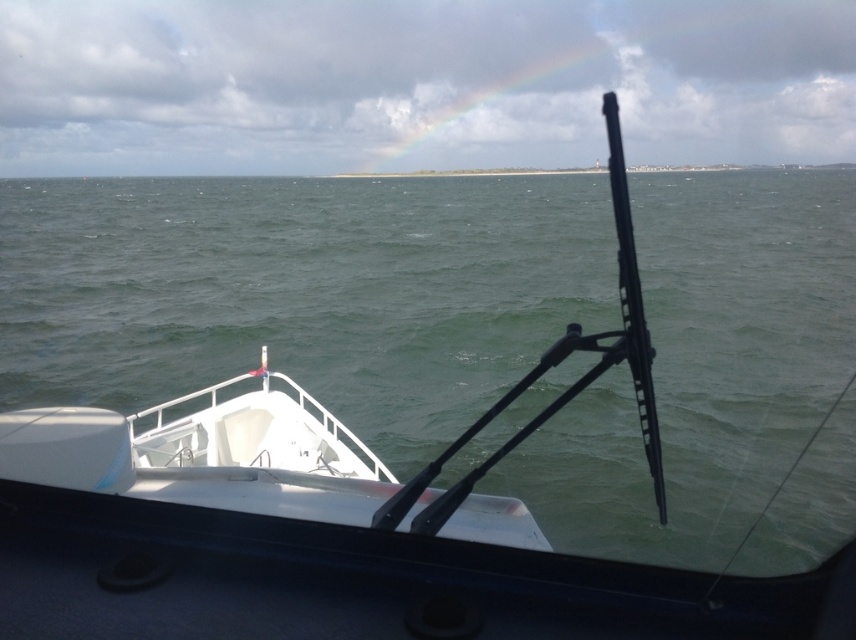
Which of these two, rainbow at upper center or white matte boat at lower left, stands taller?

Standing taller between the two is rainbow at upper center.

Who is more distant from viewer, (587, 52) or (27, 460)?

The point (587, 52) is more distant.

The image size is (856, 640). I want to click on rainbow at upper center, so click(601, 81).

Which is more to the left, green matte water at center or white matte boat at lower left?

white matte boat at lower left

Who is shorter, green matte water at center or white matte boat at lower left?

white matte boat at lower left is shorter.

Which is in front, point (688, 476) or point (283, 481)?

Positioned in front is point (283, 481).

This screenshot has height=640, width=856. Identify the location of green matte water at center. (300, 291).

Between green matte water at center and rainbow at upper center, which one appears on the left side from the viewer's perspective?

green matte water at center

Who is more distant from viewer, (510, 360) or (813, 42)?

The point (813, 42) is more distant.

Describe the element at coordinates (300, 291) in the screenshot. The width and height of the screenshot is (856, 640). I see `green matte water at center` at that location.

The height and width of the screenshot is (640, 856). In order to click on green matte water at center in this screenshot , I will do `click(300, 291)`.